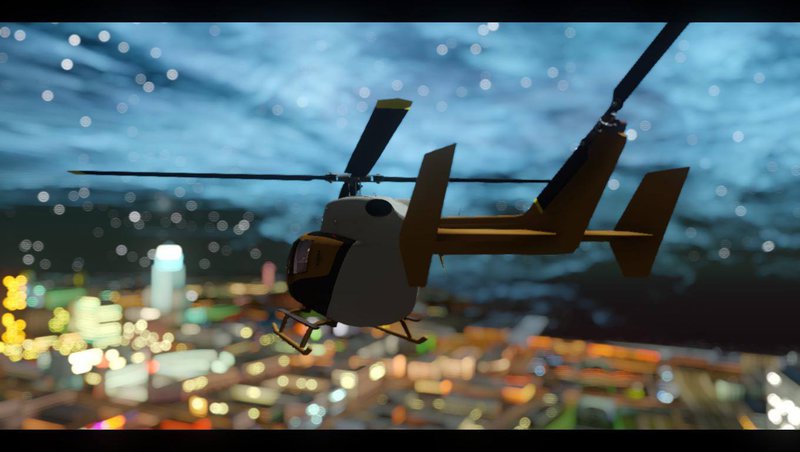
Locate an element on the screen. The width and height of the screenshot is (800, 452). white light is located at coordinates [x=788, y=409], [x=81, y=356].